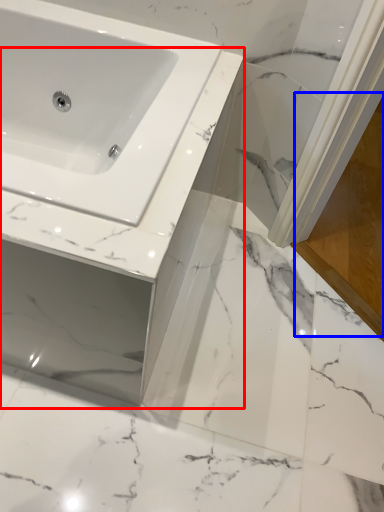
Question: Which object is closer to the camera taking this photo, counter top (highlighted by a red box) or screen door (highlighted by a blue box)?

Choices:
 (A) counter top
 (B) screen door

Answer: (A)